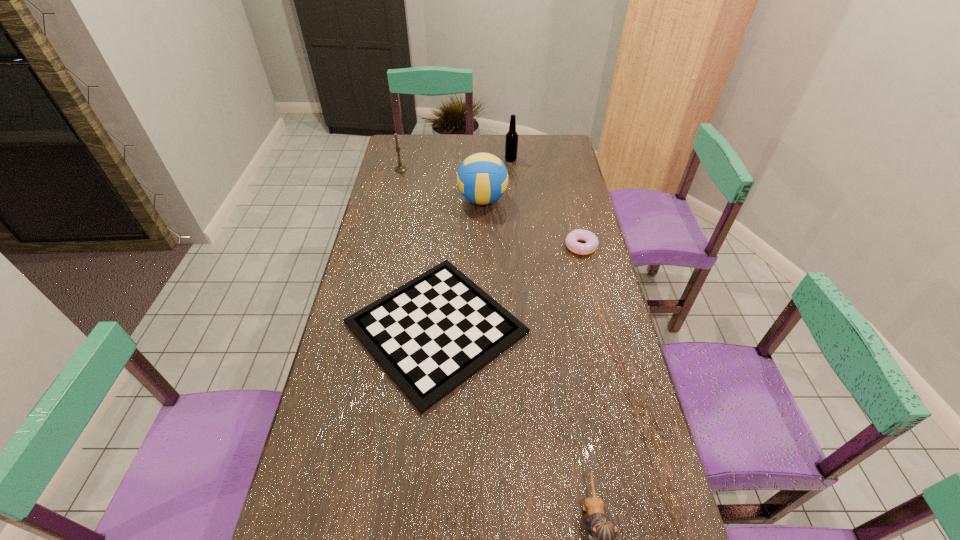
You are a GUI agent. You are given a task and a screenshot of the screen. Output one action in this format:
    pyautogui.click(x=<x>, y=<y>)
    Task: Click on the beer bottle
    
    Given the screenshot: What is the action you would take?
    pyautogui.click(x=511, y=143)

Locate an element on the screen. This screenshot has height=540, width=960. volleyball is located at coordinates (482, 178).

Find the location of a particular element. candle is located at coordinates (400, 168).

The image size is (960, 540). Find the location of `the fourth shortest object`. the fourth shortest object is located at coordinates click(x=400, y=168).

At what (x,y) coordinates should I click in order to perform the action: click on doughnut. Please return your answer as a coordinate pair (x, y). This screenshot has height=540, width=960. Looking at the image, I should click on (590, 246).

The width and height of the screenshot is (960, 540). I want to click on the fourth farthest object, so click(590, 246).

Where is `checkerboard`? checkerboard is located at coordinates (430, 335).

At what (x,y) coordinates should I click in order to perform the action: click on the second nearest object. Please return your answer as a coordinate pair (x, y). Looking at the image, I should click on (430, 335).

Where is `free space located on the left of the beer bottle`? This screenshot has width=960, height=540. free space located on the left of the beer bottle is located at coordinates (430, 159).

Locate an element on the screen. The width and height of the screenshot is (960, 540). vacant region located 0.250m on the left of the third farthest object is located at coordinates 395,200.